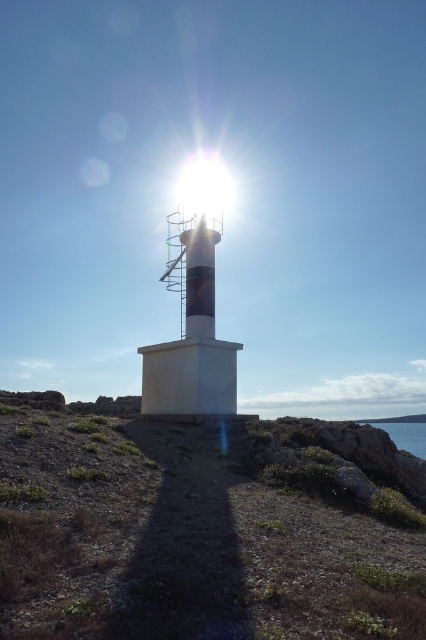
Question: Does dull brown dirt at center have a larger size compared to blue water at lower right?

Choices:
 (A) no
 (B) yes

Answer: (B)

Question: Among these objects, which one is farthest from the camera?

Choices:
 (A) dull brown dirt at center
 (B) bright white lens flare at upper center

Answer: (B)

Question: Is dull brown dirt at center above blue water at lower right?

Choices:
 (A) yes
 (B) no

Answer: (A)

Question: Which object is positioned farthest from the bright white lens flare at upper center?

Choices:
 (A) blue water at lower right
 (B) dull brown dirt at center

Answer: (A)

Question: Does dull brown dirt at center appear under blue water at lower right?

Choices:
 (A) yes
 (B) no

Answer: (B)

Question: Which of the following is the closest to the observer?

Choices:
 (A) blue water at lower right
 (B) dull brown dirt at center
 (C) bright white lens flare at upper center

Answer: (B)